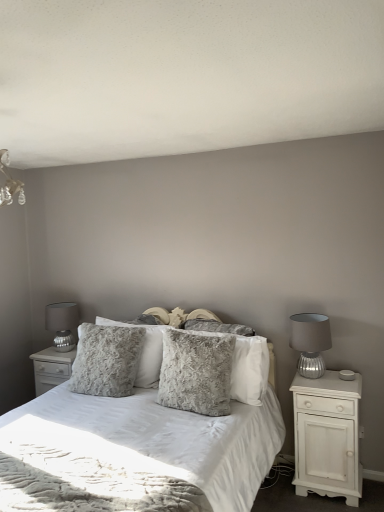
Question: Is white wood nightstand at right, which ranks as the 2th nightstand in back-to-front order, bigger than fuzzy fabric bed at center?

Choices:
 (A) yes
 (B) no

Answer: (B)

Question: Is white wood nightstand at right, arranged as the 2th nightstand when viewed from the left, outside fuzzy fabric bed at center?

Choices:
 (A) yes
 (B) no

Answer: (A)

Question: Considering the relative positions of white wood nightstand at right, which ranks as the 2th nightstand in back-to-front order, and fuzzy fabric bed at center in the image provided, is white wood nightstand at right, which ranks as the 2th nightstand in back-to-front order, to the left of fuzzy fabric bed at center from the viewer's perspective?

Choices:
 (A) yes
 (B) no

Answer: (B)

Question: Are white wood nightstand at right, the 1th nightstand in the front-to-back sequence, and fuzzy fabric bed at center located far from each other?

Choices:
 (A) no
 (B) yes

Answer: (A)

Question: Does white wood nightstand at right, which ranks as the 2th nightstand in back-to-front order, lie behind fuzzy fabric bed at center?

Choices:
 (A) no
 (B) yes

Answer: (B)

Question: In the image, is fuzzy fabric bed at center positioned in front of or behind matte silver lamp at right, the 1th table lamp positioned from the front?

Choices:
 (A) front
 (B) behind

Answer: (A)

Question: From the image's perspective, relative to matte silver lamp at right, which is the second table lamp in back-to-front order, is fuzzy fabric bed at center above or below?

Choices:
 (A) above
 (B) below

Answer: (B)

Question: Is fuzzy fabric bed at center spatially inside matte silver lamp at right, which appears as the 1th table lamp when viewed from the right, or outside of it?

Choices:
 (A) inside
 (B) outside

Answer: (B)

Question: Visually, is fuzzy fabric bed at center positioned to the left or to the right of matte silver lamp at right, which appears as the 1th table lamp when viewed from the right?

Choices:
 (A) right
 (B) left

Answer: (B)

Question: Is white wood nightstand at right, the 1th nightstand in the front-to-back sequence, taller or shorter than fuzzy gray pillow at center, acting as the 2th pillow starting from the back?

Choices:
 (A) short
 (B) tall

Answer: (B)

Question: Relative to fuzzy gray pillow at center, acting as the 2th pillow starting from the back, is white wood nightstand at right, the 1th nightstand in the front-to-back sequence, in front or behind?

Choices:
 (A) behind
 (B) front

Answer: (B)

Question: From the image's perspective, relative to fuzzy gray pillow at center, acting as the 2th pillow starting from the back, is white wood nightstand at right, which ranks as the 2th nightstand in back-to-front order, above or below?

Choices:
 (A) above
 (B) below

Answer: (B)

Question: Is white wood nightstand at right, arranged as the 2th nightstand when viewed from the left, to the left or to the right of fuzzy gray pillow at center, acting as the 2th pillow starting from the back, in the image?

Choices:
 (A) right
 (B) left

Answer: (A)

Question: Would you say fuzzy gray pillow at center, acting as the 2th pillow starting from the back, is inside or outside fluffy gray pillow at center, the 1th pillow when ordered from back to front?

Choices:
 (A) outside
 (B) inside

Answer: (A)

Question: From the image's perspective, is fuzzy gray pillow at center, marked as the second pillow in a front-to-back arrangement, positioned above or below fluffy gray pillow at center, which is the 3th pillow from front to back?

Choices:
 (A) below
 (B) above

Answer: (B)